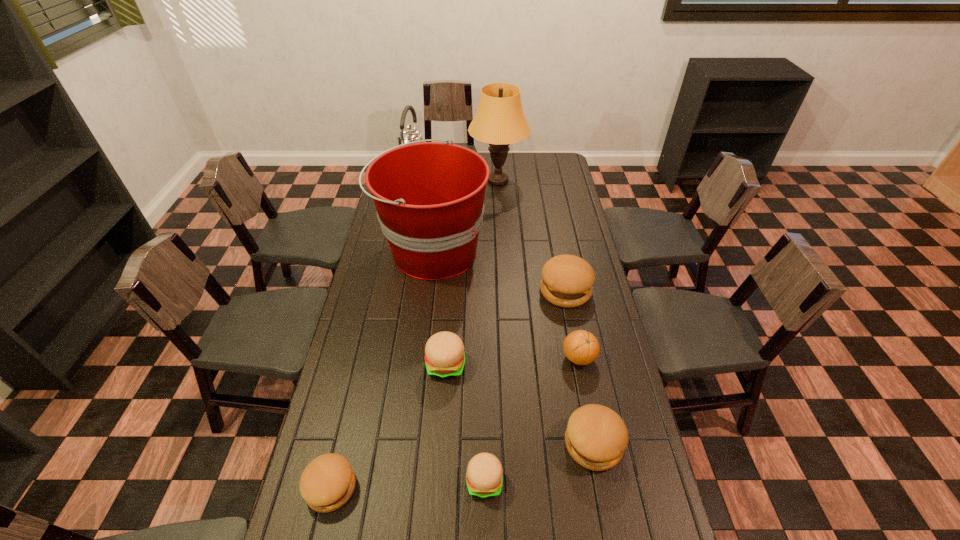
Where is `free area in between the bucket and the orange`? free area in between the bucket and the orange is located at coordinates (506, 304).

You are a GUI agent. You are given a task and a screenshot of the screen. Output one action in this format:
    pyautogui.click(x=<x>, y=<y>)
    Task: Click on the object that ranks as the sixth closest to the second smallest brown hamburger
    The height and width of the screenshot is (540, 960).
    Given the screenshot: What is the action you would take?
    pyautogui.click(x=429, y=196)

This screenshot has width=960, height=540. I want to click on object that is the fifth closest one to the right beige hamburger, so click(x=567, y=281).

Find the location of `the fifth closest hamburger relative to the kettle`. the fifth closest hamburger relative to the kettle is located at coordinates (484, 477).

Where is `hamburger that is the nearest to the second smallest brown hamburger`? This screenshot has width=960, height=540. hamburger that is the nearest to the second smallest brown hamburger is located at coordinates (484, 477).

Choose which brown hamburger is the third nearest neighbor to the red bucket. Please provide its 2D coordinates. Your answer should be formatted as a tuple, i.e. [(x, y)], where the tuple contains the x and y coordinates of a point satisfying the conditions above.

[(328, 481)]

Find the location of a particular element. The image size is (960, 540). the closest brown hamburger relative to the second smallest brown hamburger is located at coordinates (567, 281).

Image resolution: width=960 pixels, height=540 pixels. I want to click on vacant area that satisfies the following two spatial constraints: 1. on the back side of the smallest brown hamburger; 2. on the right side of the second biggest brown hamburger, so click(341, 443).

You are a GUI agent. You are given a task and a screenshot of the screen. Output one action in this format:
    pyautogui.click(x=<x>, y=<y>)
    Task: Click on the vacant space that satisfies the following two spatial constraints: 1. on the front side of the second smallest brown hamburger; 2. on the right side of the lampshade
    
    Given the screenshot: What is the action you would take?
    pyautogui.click(x=512, y=443)

The width and height of the screenshot is (960, 540). Identify the location of free spot that satisfies the following two spatial constraints: 1. on the back side of the farthest brown hamburger; 2. on the left side of the bigger beige hamburger. pos(451,291).